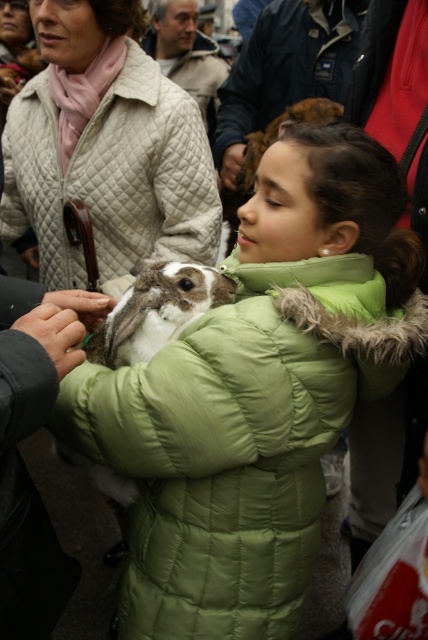
Question: Which point is closer to the camera?

Choices:
 (A) dark gray fabric hand at lower left
 (B) quilted beige jacket at upper left
 (C) brown fur rabbit at center
 (D) white matte skin at center

Answer: (A)

Question: Is green quilted coat at center above white matte skin at center?

Choices:
 (A) yes
 (B) no

Answer: (B)

Question: Based on their relative distances, which object is nearer to the quilted beige jacket at upper left?

Choices:
 (A) white matte skin at center
 (B) dark gray fabric hand at lower left
 (C) green quilted coat at center

Answer: (A)

Question: Is quilted beige jacket at upper left above brown fur rabbit at center?

Choices:
 (A) no
 (B) yes

Answer: (B)

Question: Which object is closer to the camera taking this photo?

Choices:
 (A) quilted beige jacket at upper left
 (B) green quilted coat at center
 (C) brown fur rabbit at center
 (D) white matte skin at center

Answer: (B)

Question: Considering the relative positions of quilted beige jacket at upper left and white matte skin at center in the image provided, where is quilted beige jacket at upper left located with respect to white matte skin at center?

Choices:
 (A) below
 (B) above

Answer: (B)